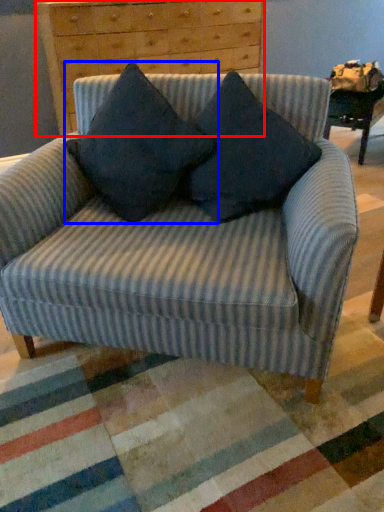
Question: Among these objects, which one is nearest to the camera, chest of drawers (highlighted by a red box) or pillow (highlighted by a blue box)?

Choices:
 (A) chest of drawers
 (B) pillow

Answer: (B)